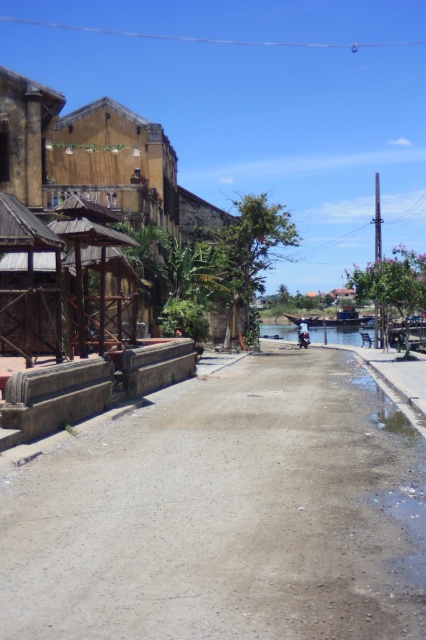
Question: Which point is closer to the camera taking this photo?

Choices:
 (A) (106, 301)
 (B) (55, 156)

Answer: (A)

Question: Does dull concrete alley at center appear over wooden hut at upper left?

Choices:
 (A) yes
 (B) no

Answer: (B)

Question: Which of these objects is positioned closest to the dull concrete alley at center?

Choices:
 (A) shiny silver motorcycle at center
 (B) wooden hut at left
 (C) wooden hut at upper left

Answer: (B)

Question: Is dull concrete alley at center smaller than wooden hut at left?

Choices:
 (A) yes
 (B) no

Answer: (B)

Question: Which object is farther from the camera taking this photo?

Choices:
 (A) blue water at center
 (B) shiny silver motorcycle at center
 (C) wooden hut at upper left

Answer: (B)

Question: Is dull concrete alley at center closer to the viewer compared to wooden hut at upper left?

Choices:
 (A) yes
 (B) no

Answer: (A)